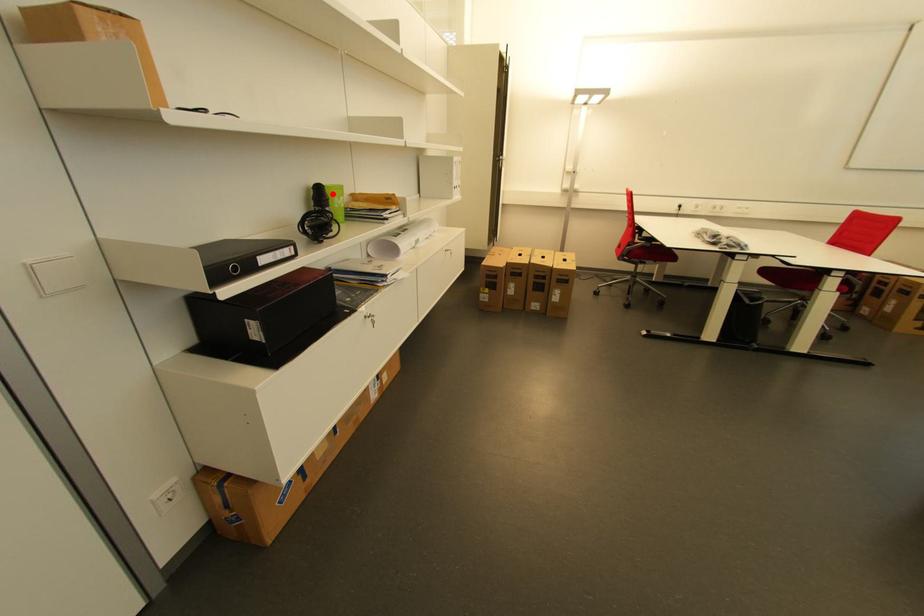
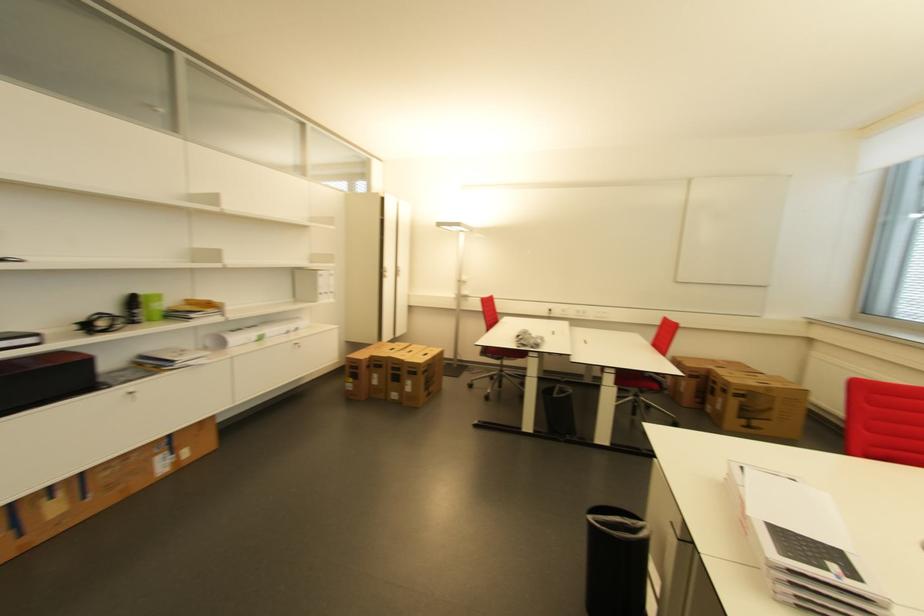
The point at the highlighted location is marked in the first image. Where is the corresponding point in the second image?

(147, 301)